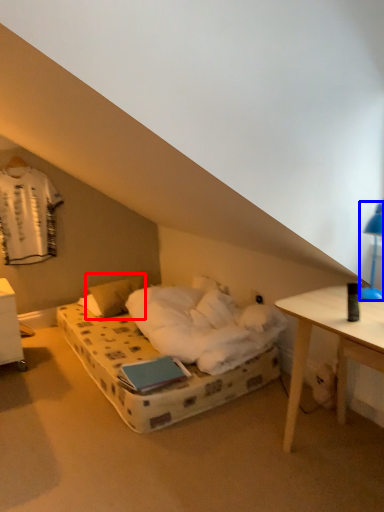
Question: Which object is closer to the camera taking this photo, pillow (highlighted by a red box) or bedside lamp (highlighted by a blue box)?

Choices:
 (A) pillow
 (B) bedside lamp

Answer: (B)